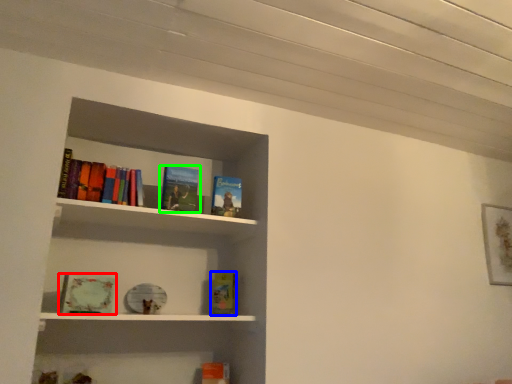
Question: Estimate the real-world distances between objects in this image. Which object is closer to book (highlighted by a red box), book (highlighted by a blue box) or book (highlighted by a green box)?

Choices:
 (A) book
 (B) book

Answer: (B)